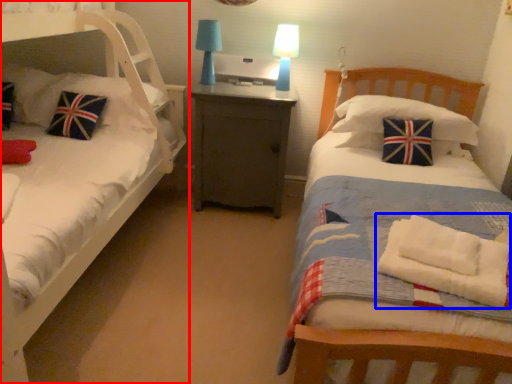
Question: Which point is further to the camera, bed (highlighted by a red box) or material (highlighted by a blue box)?

Choices:
 (A) bed
 (B) material

Answer: (B)